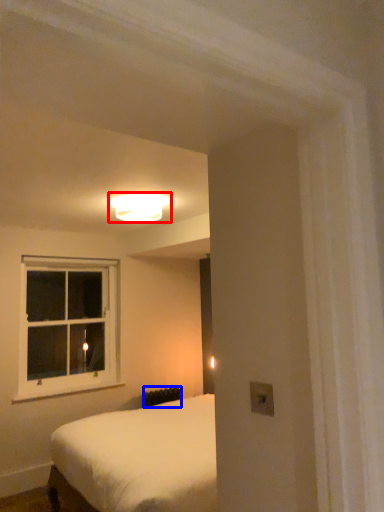
Question: Which object is further to the camera taking this photo, lamp (highlighted by a red box) or radiator (highlighted by a blue box)?

Choices:
 (A) lamp
 (B) radiator

Answer: (B)